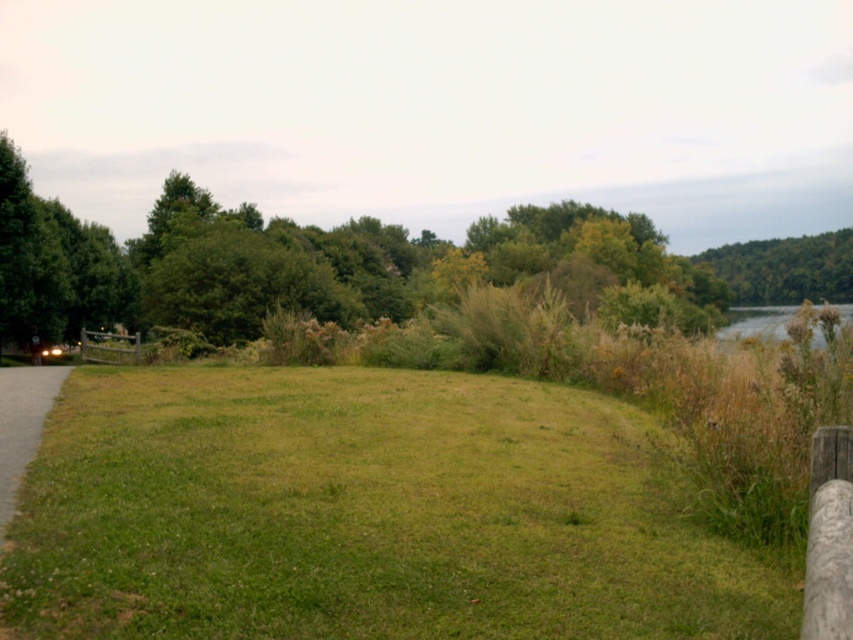
Question: Which of these objects is positioned closest to the green grassy at center?

Choices:
 (A) green leafy hill at upper right
 (B) green leafy tree at left

Answer: (B)

Question: Which object is positioned farthest from the green leafy tree at left?

Choices:
 (A) green leafy hill at upper right
 (B) green grassy at center

Answer: (B)

Question: Which of these objects is positioned closest to the green leafy tree at left?

Choices:
 (A) green grassy at center
 (B) green leafy hill at upper right

Answer: (B)

Question: Is green grassy at center below green leafy hill at upper right?

Choices:
 (A) no
 (B) yes

Answer: (B)

Question: Is green grassy at center above green leafy hill at upper right?

Choices:
 (A) no
 (B) yes

Answer: (A)

Question: Is green grassy at center to the right of green leafy tree at left from the viewer's perspective?

Choices:
 (A) no
 (B) yes

Answer: (B)